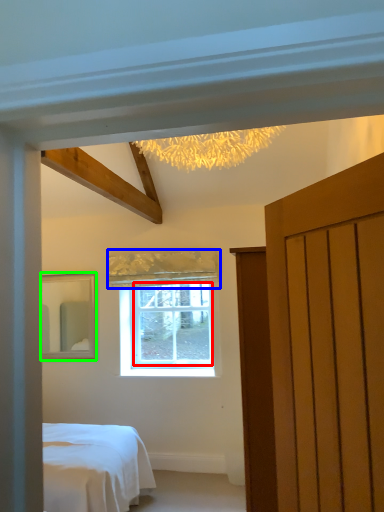
Question: Which object is positioned farthest from window screen (highlighted by a red box)? Select from curtain (highlighted by a blue box) and mirror (highlighted by a green box).

Choices:
 (A) curtain
 (B) mirror

Answer: (B)